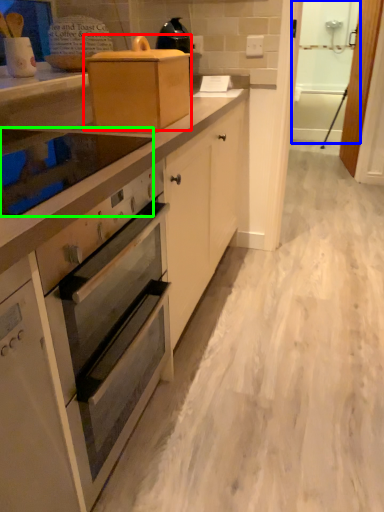
Question: Estimate the real-world distances between objects in this image. Which object is farther from appliance (highlighted by a red box), screen door (highlighted by a blue box) or home appliance (highlighted by a green box)?

Choices:
 (A) screen door
 (B) home appliance

Answer: (A)